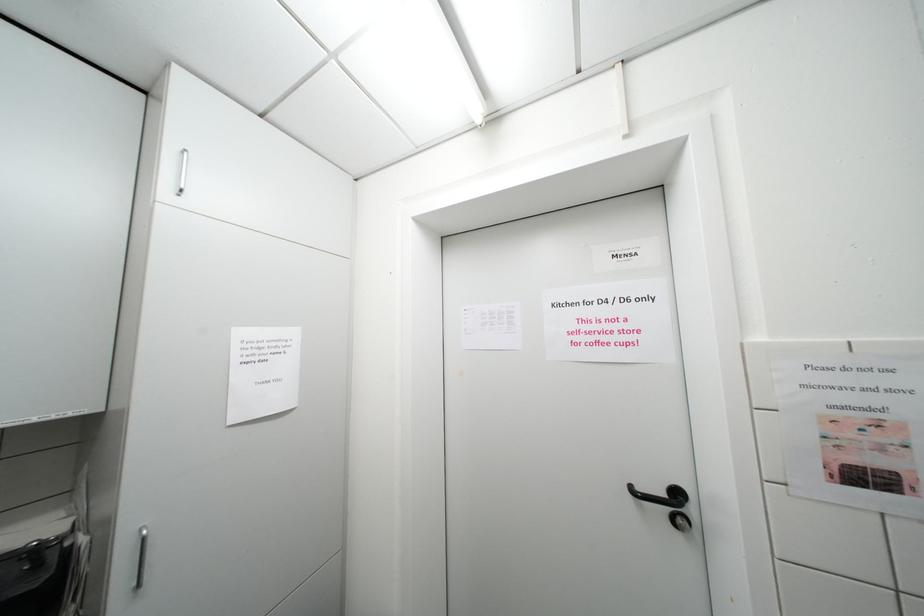
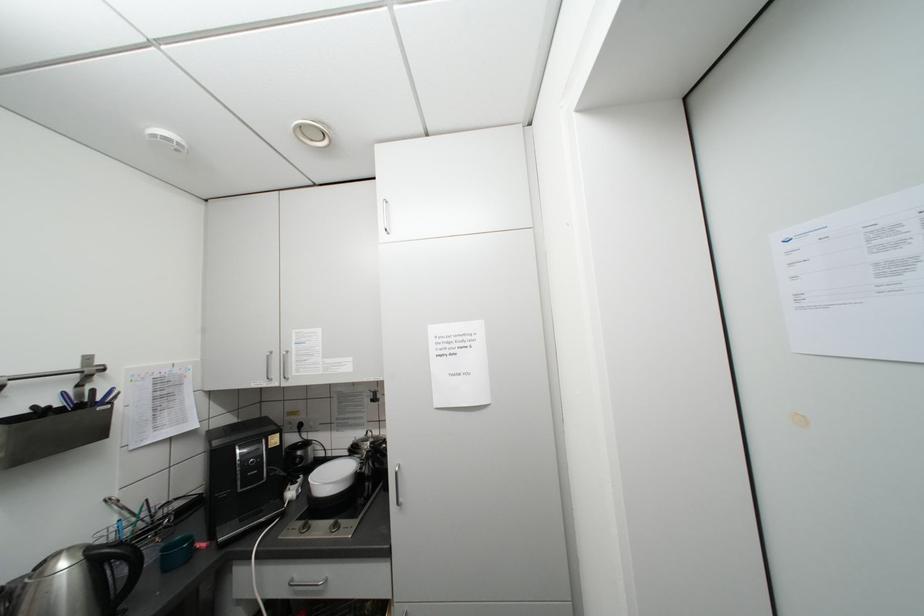
Question: Based on the continuous images, in which direction is the camera rotating? Reply with the corresponding letter.

Choices:
 (A) Left
 (B) Right
 (C) Up
 (D) Down

Answer: (A)